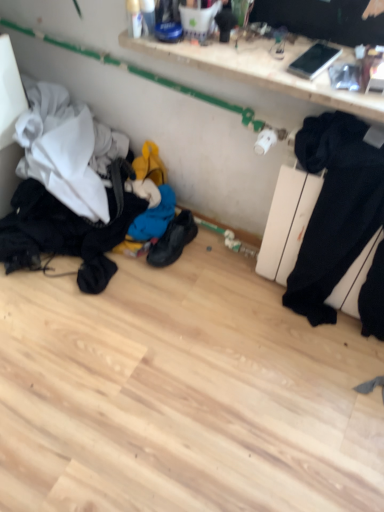
Question: Considering the relative sizes of black leather shoes at center and black matte sweat pants at right in the image provided, is black leather shoes at center taller than black matte sweat pants at right?

Choices:
 (A) no
 (B) yes

Answer: (A)

Question: From a real-world perspective, is black leather shoes at center physically below black matte sweat pants at right?

Choices:
 (A) yes
 (B) no

Answer: (A)

Question: Can you confirm if black leather shoes at center is smaller than black matte sweat pants at right?

Choices:
 (A) no
 (B) yes

Answer: (B)

Question: Is black leather shoes at center wider than black matte sweat pants at right?

Choices:
 (A) no
 (B) yes

Answer: (B)

Question: Is the depth of black leather shoes at center less than that of black matte sweat pants at right?

Choices:
 (A) no
 (B) yes

Answer: (A)

Question: From the image's perspective, is black leather shoes at center over black matte sweat pants at right?

Choices:
 (A) yes
 (B) no

Answer: (B)

Question: Considering the relative positions of white glossy shelf at upper center and black fabric laundry at lower left in the image provided, is white glossy shelf at upper center in front of black fabric laundry at lower left?

Choices:
 (A) no
 (B) yes

Answer: (B)

Question: Is white glossy shelf at upper center positioned far away from black fabric laundry at lower left?

Choices:
 (A) no
 (B) yes

Answer: (A)

Question: Considering the relative sizes of white glossy shelf at upper center and black fabric laundry at lower left in the image provided, is white glossy shelf at upper center wider than black fabric laundry at lower left?

Choices:
 (A) yes
 (B) no

Answer: (B)

Question: From a real-world perspective, is white glossy shelf at upper center positioned under black fabric laundry at lower left based on gravity?

Choices:
 (A) yes
 (B) no

Answer: (B)

Question: Is the position of white glossy shelf at upper center more distant than that of black fabric laundry at lower left?

Choices:
 (A) yes
 (B) no

Answer: (B)

Question: Does white glossy shelf at upper center have a greater height compared to black fabric laundry at lower left?

Choices:
 (A) no
 (B) yes

Answer: (A)

Question: Is black leather shoes at center turned away from black fabric laundry at lower left?

Choices:
 (A) no
 (B) yes

Answer: (A)